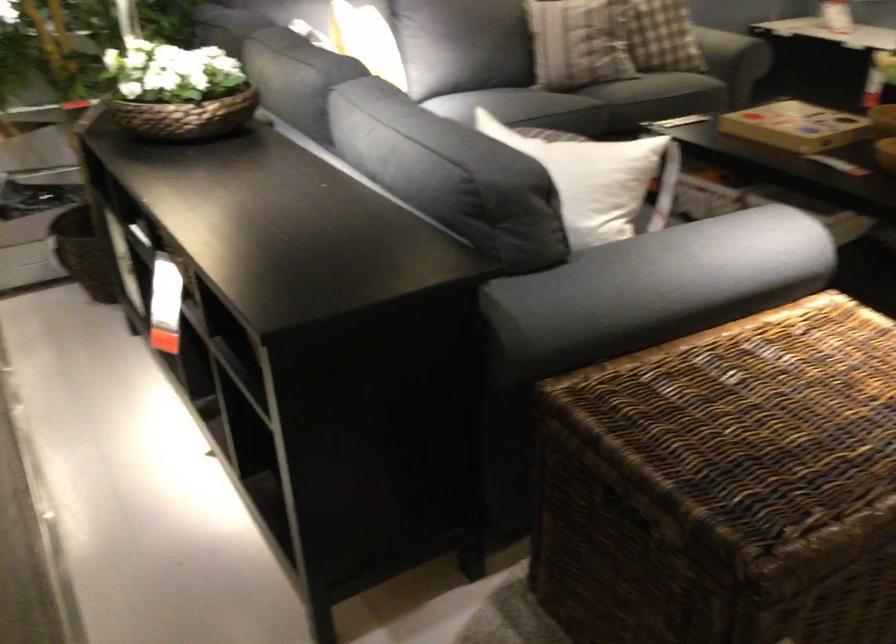
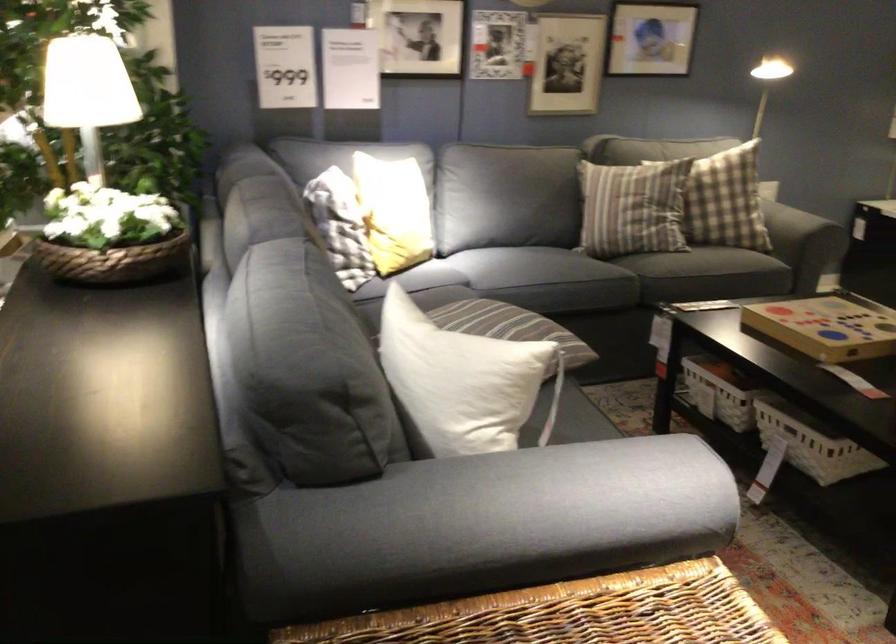
Which direction would the cameraman need to move to produce the second image?

The cameraman moved toward right, forward.